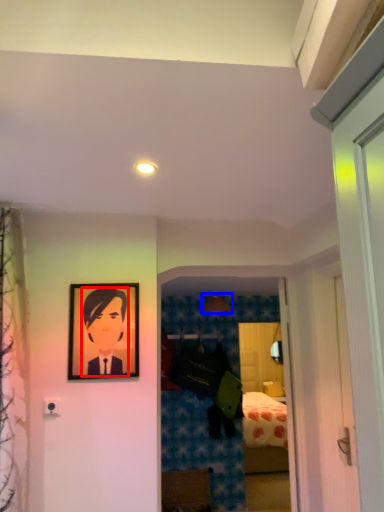
Question: Which point is further to the camera, person (highlighted by a red box) or lamp (highlighted by a blue box)?

Choices:
 (A) person
 (B) lamp

Answer: (B)